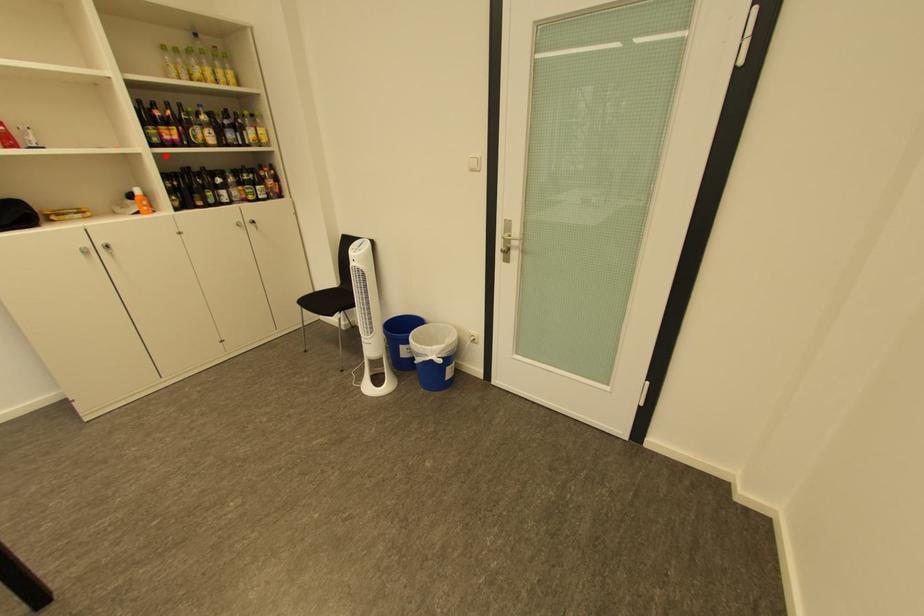
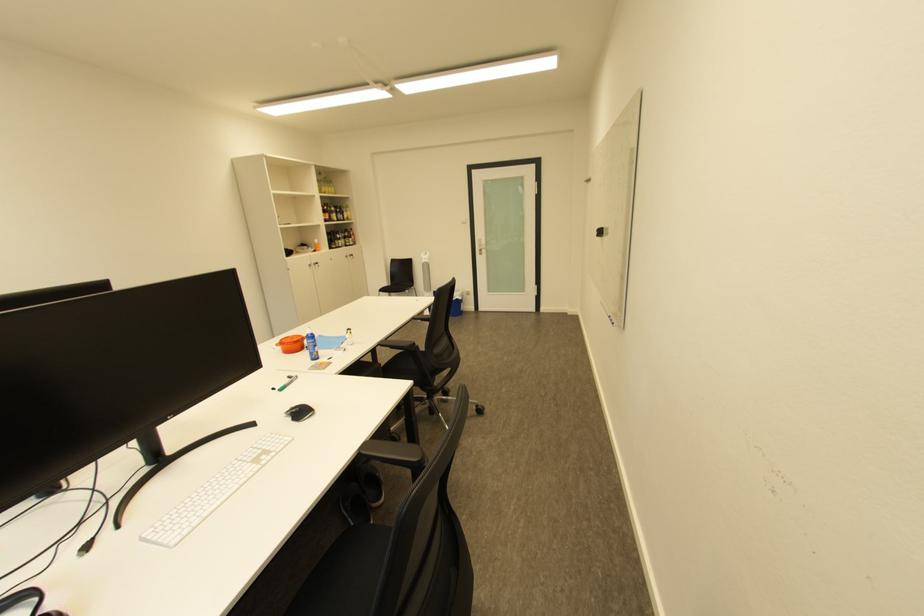
Find the pixel in the second image that matches the highlighted location in the first image.

(335, 225)